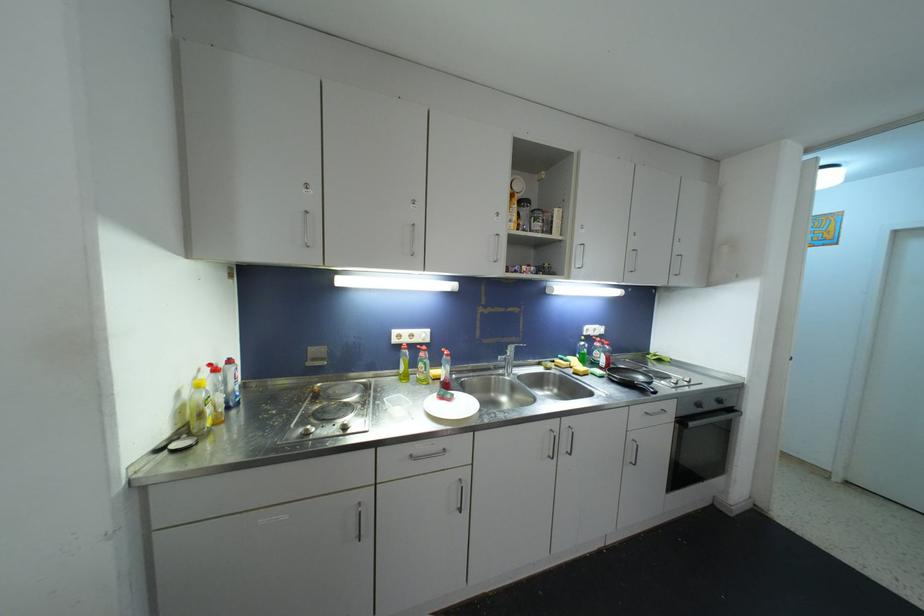
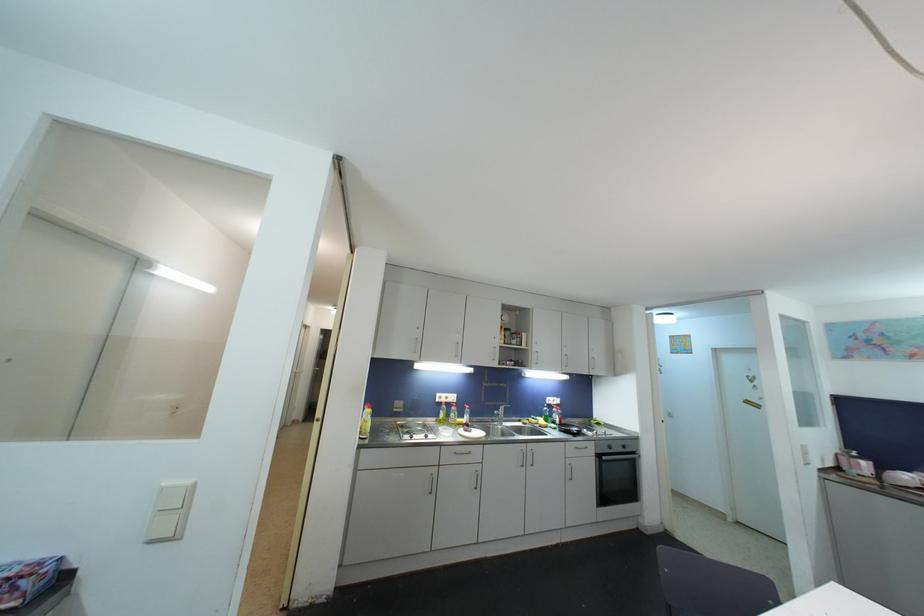
Find the pixel in the second image that matches point (701, 408) in the first image.

(613, 450)